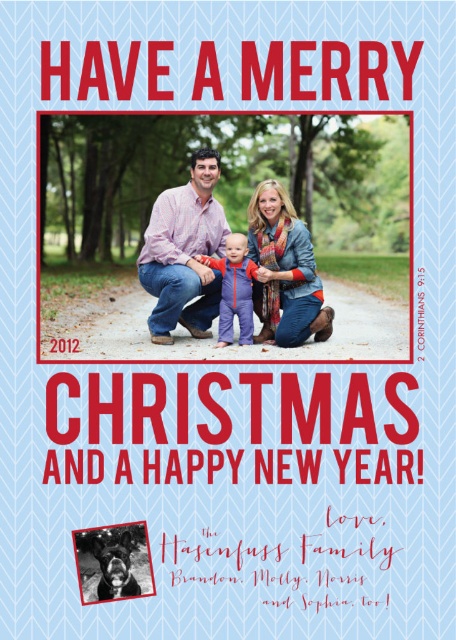
Does denim jacket at center have a lesser width compared to purple fleece jumpsuit at center?

Incorrect, denim jacket at center's width is not less than purple fleece jumpsuit at center's.

Between denim jacket at center and purple fleece jumpsuit at center, which one is positioned higher?

denim jacket at center is higher up.

Who is more distant from viewer, (197, 330) or (232, 323)?

The point (197, 330) is behind.

Where is `denim jacket at center`? denim jacket at center is located at coordinates (185, 252).

Which is behind, point (218, 154) or point (150, 316)?

Point (150, 316)

Is point (202, 298) positioned in front of point (218, 224)?

No.

Locate an element on the screen. The height and width of the screenshot is (640, 456). denim jacket at center is located at coordinates (185, 252).

Does matte pink shirt at center have a lesser height compared to purple fleece jumpsuit at center?

Incorrect, matte pink shirt at center's height does not fall short of purple fleece jumpsuit at center's.

Is point (181, 253) positioned in front of point (218, 262)?

That is True.

Who is more forward, (177, 305) or (250, 310)?

Point (177, 305)

Where is `matte pink shirt at center`? Image resolution: width=456 pixels, height=640 pixels. matte pink shirt at center is located at coordinates (185, 252).